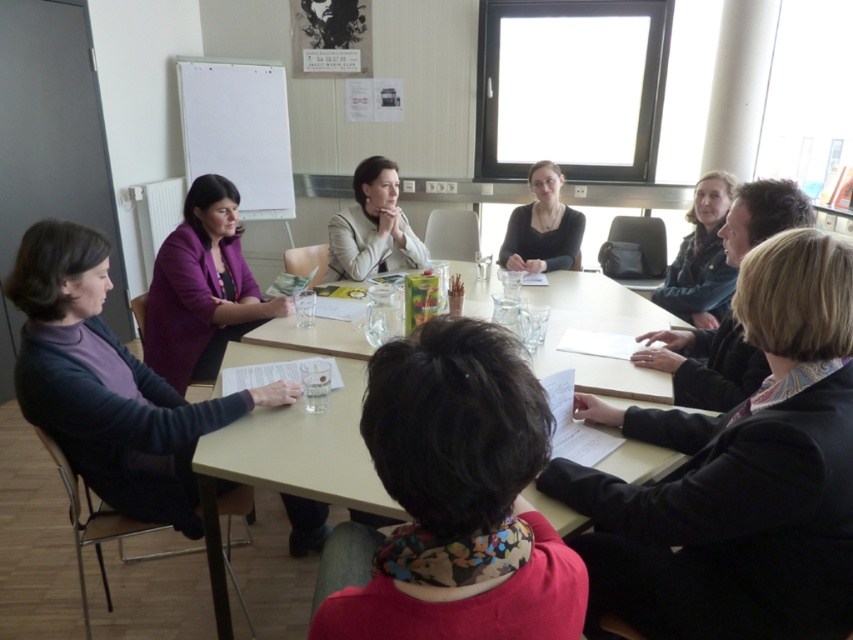
Can you confirm if purple matte blazer at upper left is positioned to the right of dark brown leather jacket at upper right?

No, purple matte blazer at upper left is not to the right of dark brown leather jacket at upper right.

Does purple matte blazer at upper left lie behind dark brown leather jacket at upper right?

Yes, purple matte blazer at upper left is further from the viewer.

Find the location of a particular element. purple matte blazer at upper left is located at coordinates (202, 289).

Is point (781, 227) positioned behind point (549, 179)?

No.

Can you confirm if dark brown leather jacket at upper right is taller than matte black shirt at center?

No.

Is point (732, 227) positioned after point (531, 230)?

No, it is in front of (531, 230).

Image resolution: width=853 pixels, height=640 pixels. I want to click on dark brown leather jacket at upper right, so click(x=706, y=364).

Is black leather jacket at lower right in front of dark brown leather jacket at upper right?

Yes.

Consider the image. Between black leather jacket at lower right and dark brown leather jacket at upper right, which one has more height?

black leather jacket at lower right

Between point (747, 253) and point (703, 333), which one is positioned in front?

Point (747, 253)

Find the location of `black leather jacket at lower right`. black leather jacket at lower right is located at coordinates (740, 474).